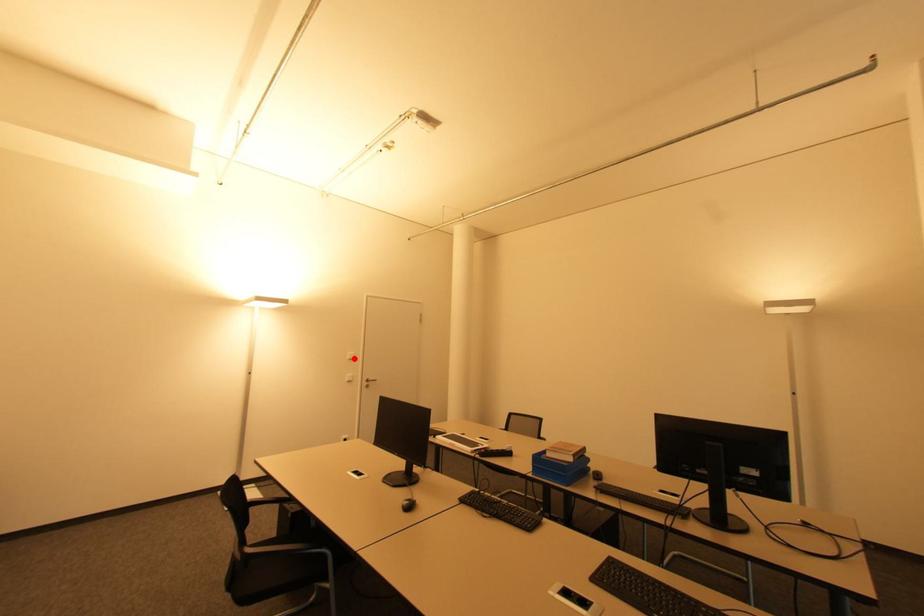
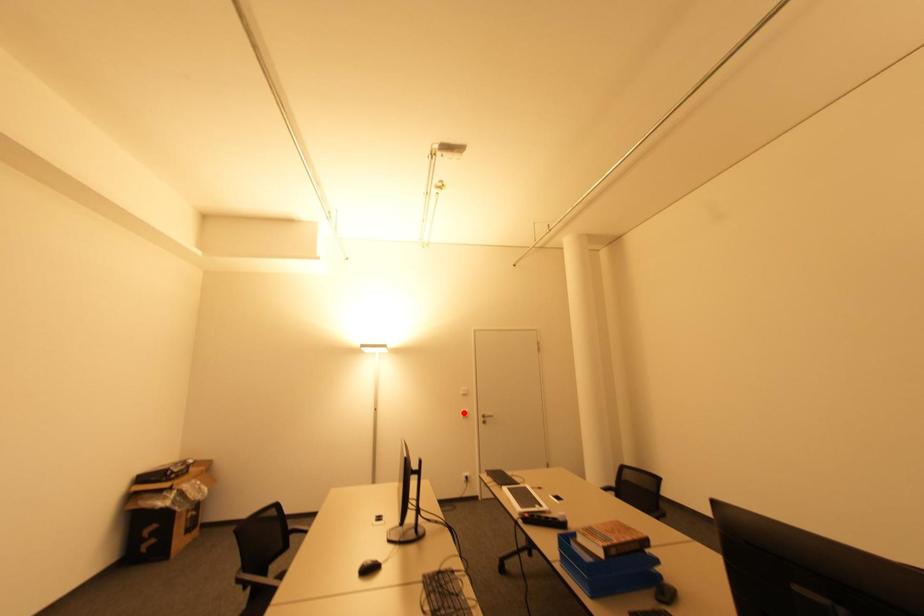
I am providing you with two images of the same scene from different viewpoints. A red point is marked on the first image and another point is marked on the second image. Does the point marked in image1 correspond to the same location as the one in image2?

No